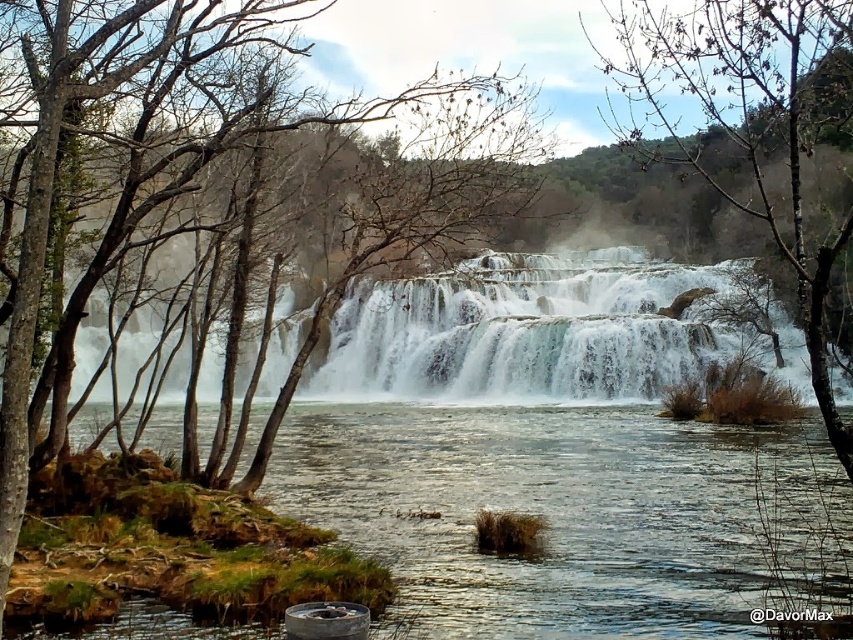
Question: Which point is farther to the camera?

Choices:
 (A) (573, 428)
 (B) (796, 243)

Answer: (A)

Question: Can you confirm if clear water at center is thinner than bare branches at center?

Choices:
 (A) no
 (B) yes

Answer: (A)

Question: Is clear water at center positioned before white frothy water at center?

Choices:
 (A) no
 (B) yes

Answer: (B)

Question: Which object appears farthest from the camera in this image?

Choices:
 (A) bare branches at center
 (B) white frothy water at center
 (C) clear water at center

Answer: (B)

Question: Is bare branches at center to the left of brown bark tree at left from the viewer's perspective?

Choices:
 (A) no
 (B) yes

Answer: (A)

Question: Among these objects, which one is nearest to the camera?

Choices:
 (A) clear water at center
 (B) white frothy water at center

Answer: (A)